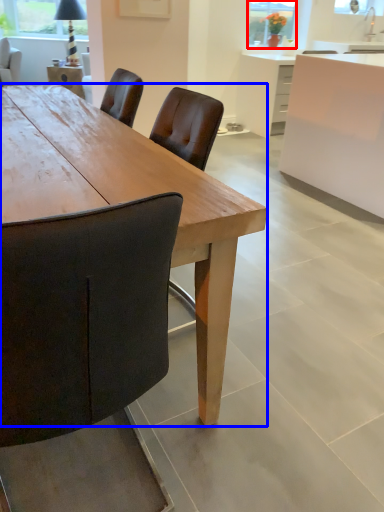
Question: Among these objects, which one is farthest to the camera, window screen (highlighted by a red box) or desk (highlighted by a blue box)?

Choices:
 (A) window screen
 (B) desk

Answer: (A)